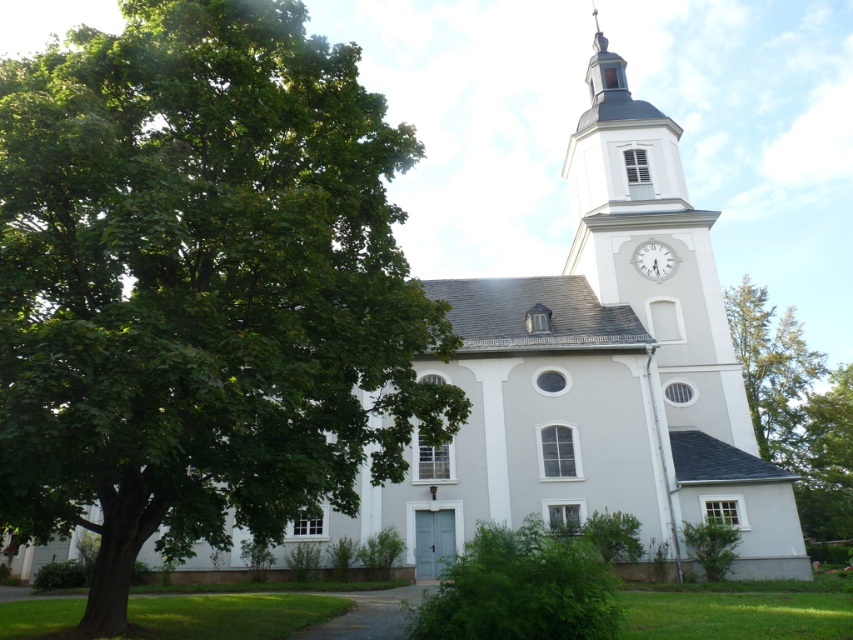
Image resolution: width=853 pixels, height=640 pixels. What do you see at coordinates (648, 240) in the screenshot?
I see `white smooth clock tower at upper right` at bounding box center [648, 240].

Who is higher up, white smooth clock tower at upper right or white glossy clock at upper center?

Positioned higher is white smooth clock tower at upper right.

Is point (735, 380) positioned behind point (643, 268)?

No, (735, 380) is in front of (643, 268).

At what (x,y) coordinates should I click in order to perform the action: click on white smooth clock tower at upper right. Please return your answer as a coordinate pair (x, y). This screenshot has width=853, height=640. Looking at the image, I should click on (648, 240).

Between green leafy tree at right and white glossy clock at upper center, which one has less height?

With less height is white glossy clock at upper center.

Who is higher up, green leafy tree at right or white glossy clock at upper center?

white glossy clock at upper center is higher up.

Where is `green leafy tree at right`? green leafy tree at right is located at coordinates (795, 408).

You are a GUI agent. You are given a task and a screenshot of the screen. Output one action in this format:
    pyautogui.click(x=<x>, y=<y>)
    Task: Click on the green leafy tree at right
    
    Given the screenshot: What is the action you would take?
    pyautogui.click(x=795, y=408)

The width and height of the screenshot is (853, 640). What do you see at coordinates (201, 285) in the screenshot?
I see `green leafy tree at left` at bounding box center [201, 285].

Is point (315, 262) less distant than point (589, 77)?

Yes, it is in front of point (589, 77).

Which is in front, point (331, 269) or point (602, 76)?

Point (331, 269) is more forward.

Identify the location of green leafy tree at left. (201, 285).